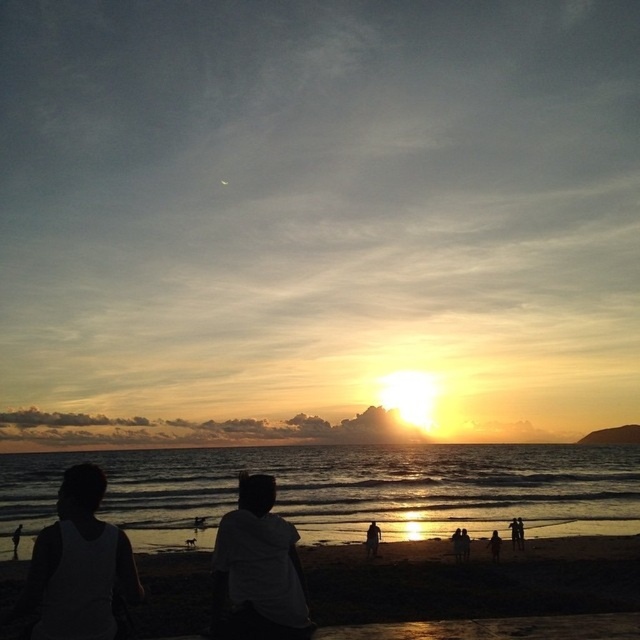
You are standing on the beach and see the shiny metallic water at center and the white matte shirt at center. Which object is located to the right side from your perspective?

The white matte shirt at center is located to the right side of the shiny metallic water at center.

You are a photographer trying to capture the sunset scene. You notice the white matte tank top at lower left and the silhouette figure at center. Based on their positions, which object is closer to the left edge of the image?

The white matte tank top at lower left is closer to the left edge of the image because it is positioned to the left of the silhouette figure at center.

You are a photographer standing at the edge of the beach, aiming to capture both the white matte tank top at lower left and the silhouette figure at center in a single frame. Given that your camera has a 50mm lens with a field of view of 46 degrees, can you determine if both objects will fit within the frame from your current position?

The distance between the white matte tank top at lower left and the silhouette figure at center is 14.87 meters. With a 50mm lens and a 46 degree field of view, the maximum width of the scene that can be captured at this distance would need to be calculated. However, without knowing the exact distance from the camera to the objects, it is impossible to definitively determine if both will fit. Additional information about the camera position relative to the subjects is required for an accurate assessment.